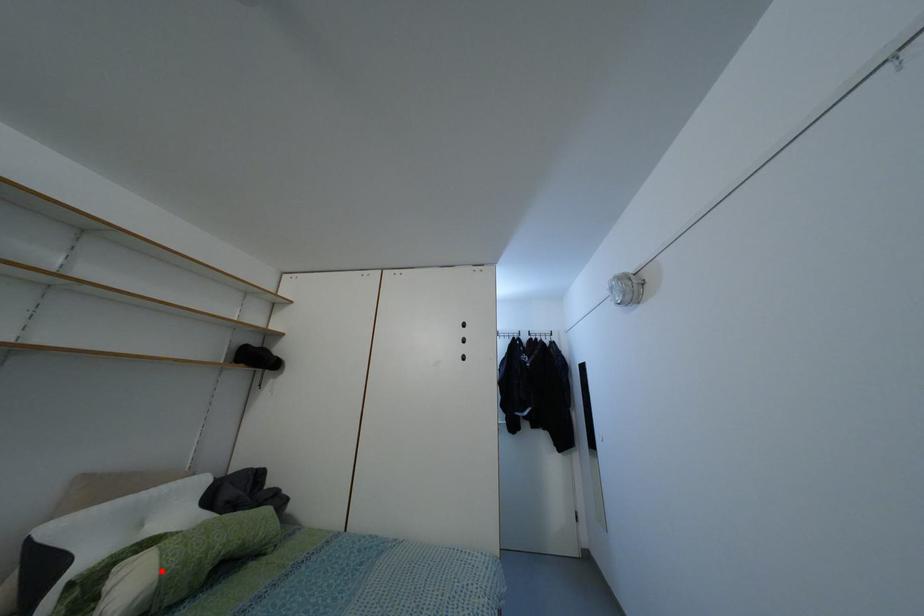
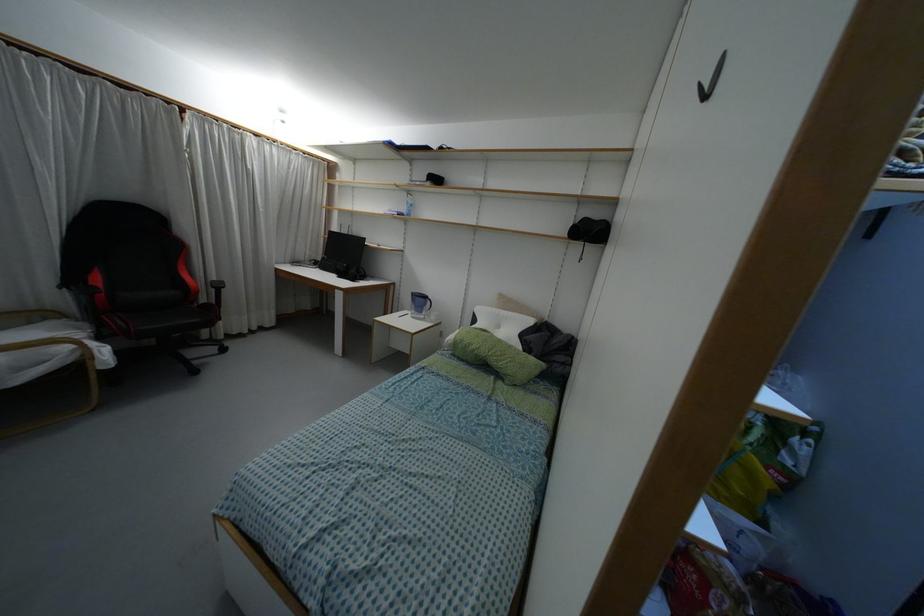
Question: I am providing you with two images of the same scene from different viewpoints. Given a red point in image1, look at the same physical point in image2. Is it:

Choices:
 (A) Closer to the viewpoint
 (B) Farther from the viewpoint

Answer: (B)